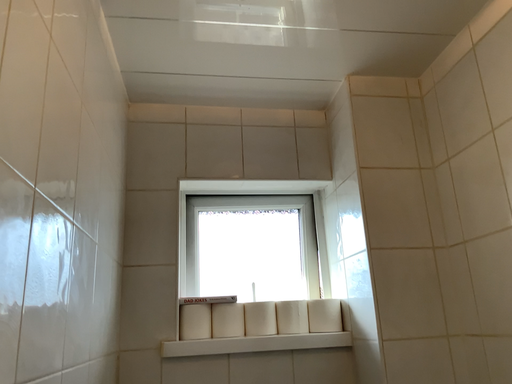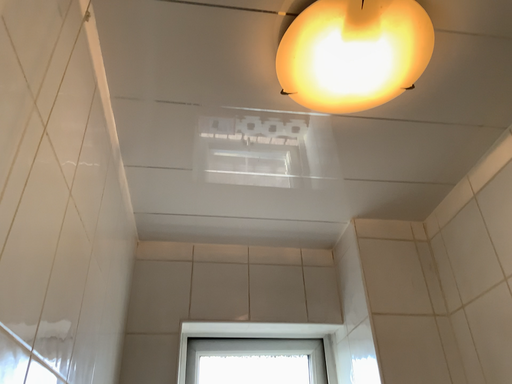
Question: How did the camera likely rotate when shooting the video?

Choices:
 (A) rotated upward
 (B) rotated downward

Answer: (A)